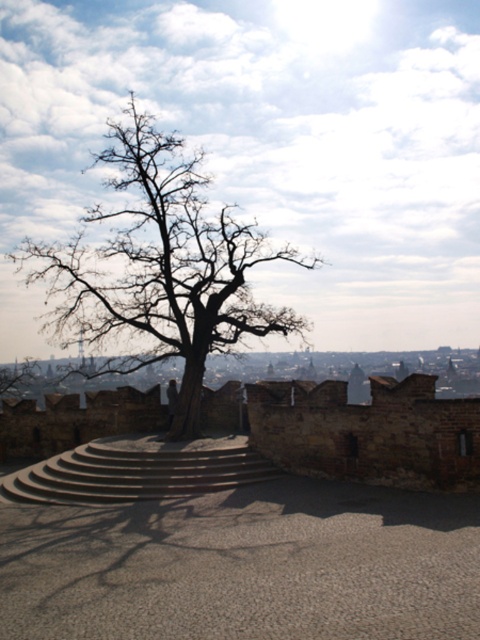
You are planning to place a large sculpture between the bare wood tree at center and the concrete stairs at center. Considering their widths, which object should the sculpture be placed closer to in order to maintain balance?

The sculpture should be placed closer to the concrete stairs at center because the bare wood tree at center is wider, so balancing by positioning the sculpture near the narrower stairs would help maintain equilibrium.

You are a painter setting up an easel to paint the scene. You want to ensure that the bare wood tree at center and the concrete stairs at center are both visible in your painting. Given that the tree is much taller than the stairs, where should you position your easel relative to the tree and stairs to capture both elements in the composition?

Since the bare wood tree at center is much taller than the concrete stairs at center, positioning the easel at a distance from the tree and stairs will allow both the height of the tree and the presence of the stairs to be captured in the painting.